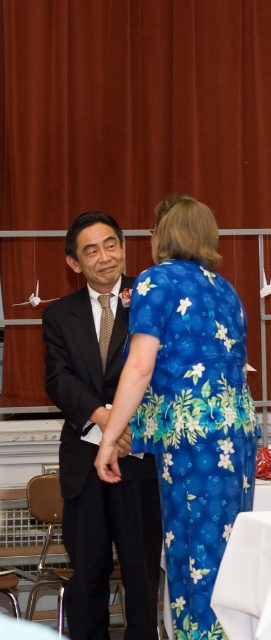
Is matte red curtain at upper center smaller than blue floral fabric dress at center?

Actually, matte red curtain at upper center might be larger than blue floral fabric dress at center.

Who is positioned more to the left, matte red curtain at upper center or blue floral fabric dress at center?

matte red curtain at upper center is more to the left.

Identify the location of matte red curtain at upper center. (140, 122).

Image resolution: width=271 pixels, height=640 pixels. What are the coordinates of `matte red curtain at upper center` in the screenshot? It's located at (140, 122).

Which of these two, matte red curtain at upper center or matte black suit at center, stands shorter?

matte black suit at center is shorter.

Between matte red curtain at upper center and matte black suit at center, which one appears on the left side from the viewer's perspective?

matte black suit at center

The height and width of the screenshot is (640, 271). What do you see at coordinates (140, 122) in the screenshot?
I see `matte red curtain at upper center` at bounding box center [140, 122].

The width and height of the screenshot is (271, 640). I want to click on matte red curtain at upper center, so click(x=140, y=122).

Locate an element on the screen. Image resolution: width=271 pixels, height=640 pixels. blue floral fabric dress at center is located at coordinates (195, 426).

Which is in front, point (171, 262) or point (237, 634)?

Point (237, 634) is more forward.

The image size is (271, 640). I want to click on blue floral fabric dress at center, so click(x=195, y=426).

Find the location of a particular element. Image resolution: width=271 pixels, height=640 pixels. blue floral fabric dress at center is located at coordinates (195, 426).